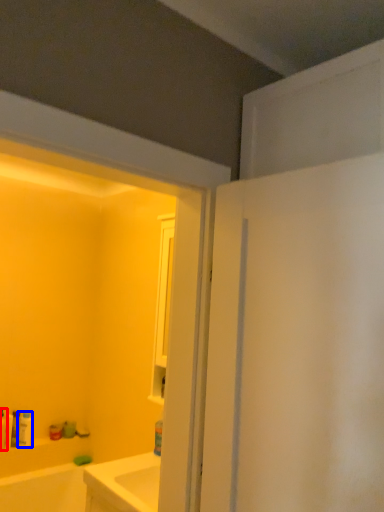
Question: Among these objects, which one is farthest to the camera, toiletry (highlighted by a red box) or toiletry (highlighted by a blue box)?

Choices:
 (A) toiletry
 (B) toiletry

Answer: (B)